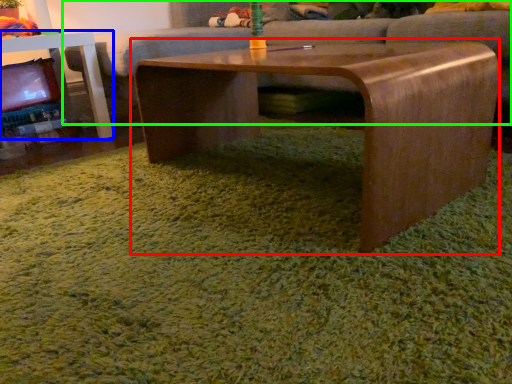
Question: Which object is the farthest from coffee table (highlighted by a red box)? Choose among these: table (highlighted by a blue box) or studio couch (highlighted by a green box).

Choices:
 (A) table
 (B) studio couch

Answer: (A)